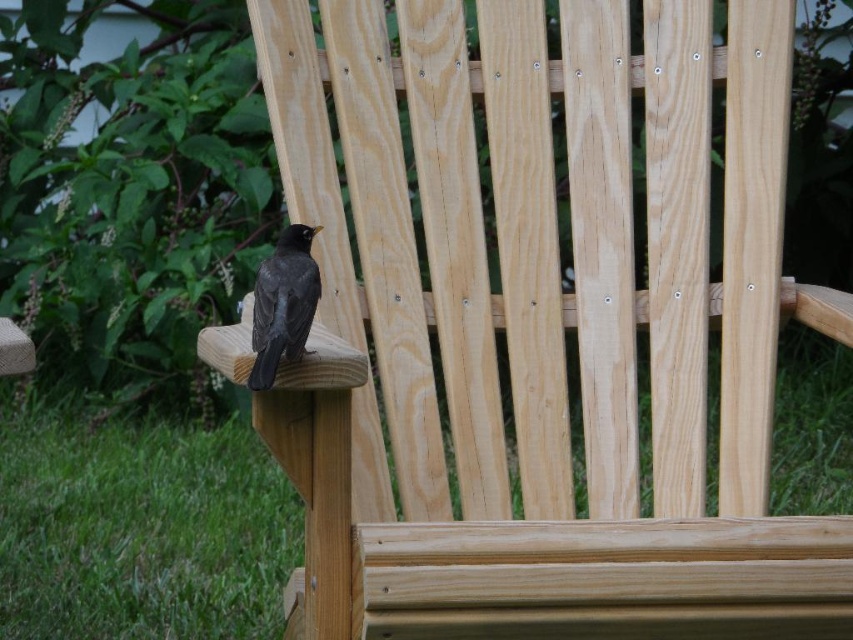
You are standing in the garden and see the wooden Adirondack chair. Which object, the green grass at lower left or the shiny black bird at left, is larger in size?

The green grass at lower left is bigger than the shiny black bird at left.

You are standing in front of the wooden Adirondack chair and want to place a small bird on one of its armrests. The bird is currently at point A located at coordinates point (810, 532) and point B at coordinates point (309, 282). Which point is closer to you so that the bird can be easily reached?

Point (810, 532) is closer to the viewer than point (309, 282), so placing the bird there would make it easier to reach.